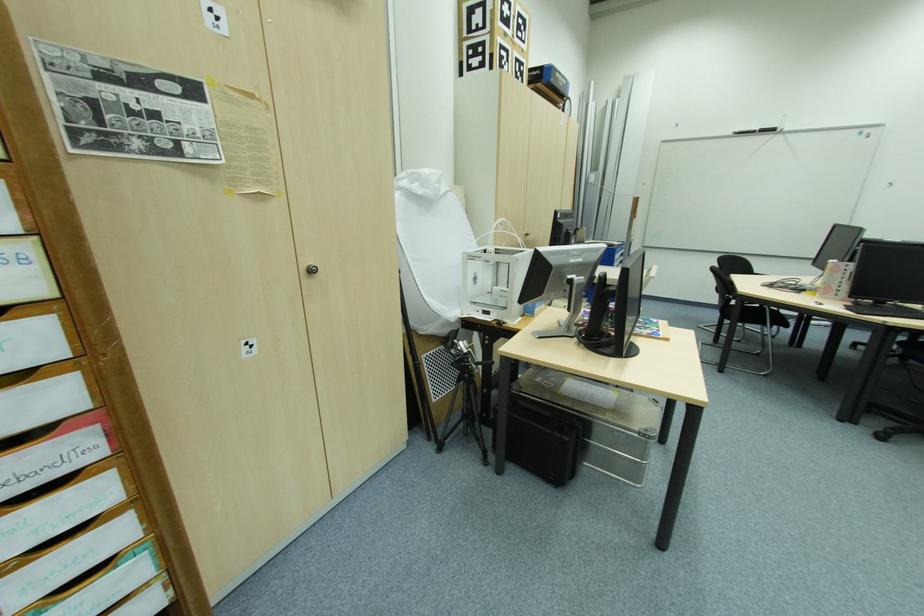
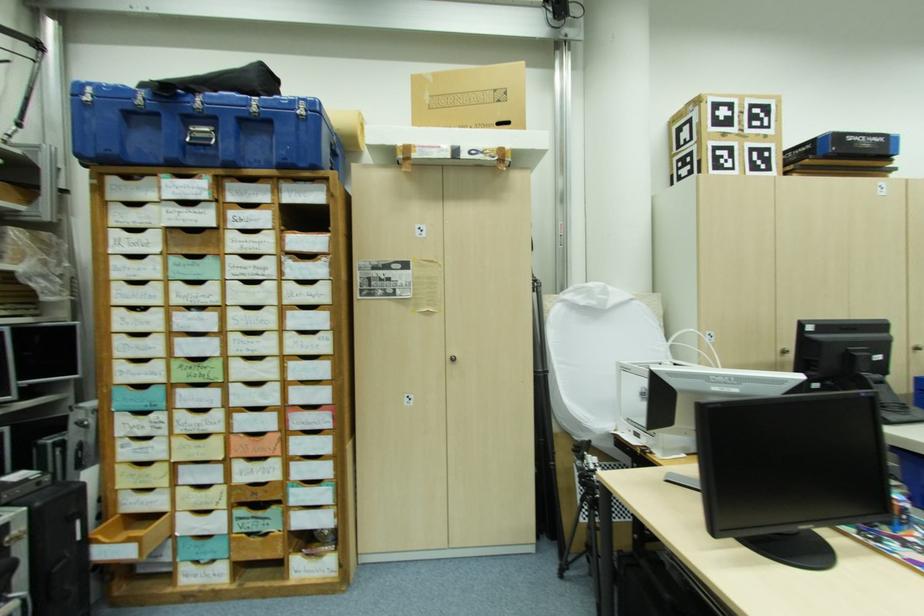
Question: The first image is from the beginning of the video and the second image is from the end. How did the camera likely rotate when shooting the video?

Choices:
 (A) Left
 (B) Right
 (C) Up
 (D) Down

Answer: (A)